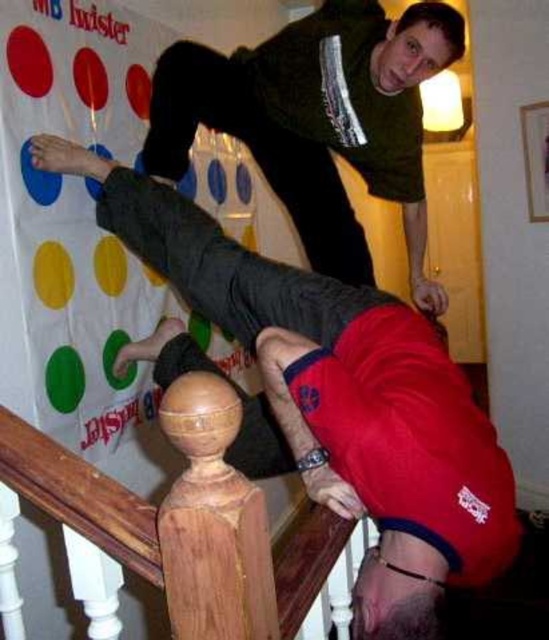
Question: From the image, what is the correct spatial relationship of matte black pants at lower center in relation to wooden at upper center?

Choices:
 (A) below
 (B) above

Answer: (B)

Question: Does matte green sweater at upper center appear on the left side of wooden at upper center?

Choices:
 (A) yes
 (B) no

Answer: (B)

Question: Which is farther from the wooden at upper center?

Choices:
 (A) matte green sweater at upper center
 (B) matte black pants at lower center

Answer: (A)

Question: Is matte green sweater at upper center closer to the viewer compared to wooden at upper center?

Choices:
 (A) no
 (B) yes

Answer: (A)

Question: Among these objects, which one is farthest from the camera?

Choices:
 (A) matte black pants at lower center
 (B) matte green sweater at upper center

Answer: (B)

Question: Which object is positioned closest to the matte black pants at lower center?

Choices:
 (A) matte green sweater at upper center
 (B) wooden at upper center

Answer: (B)